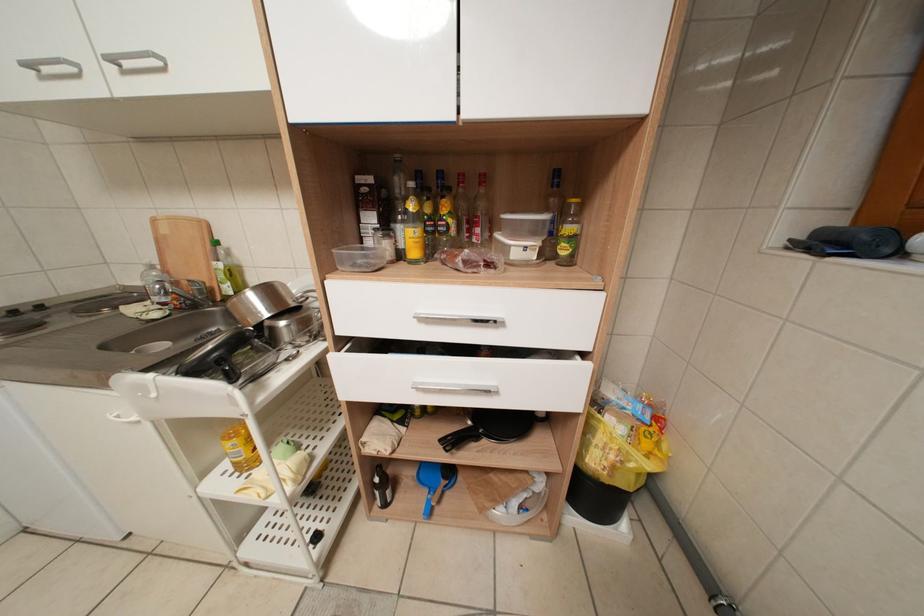
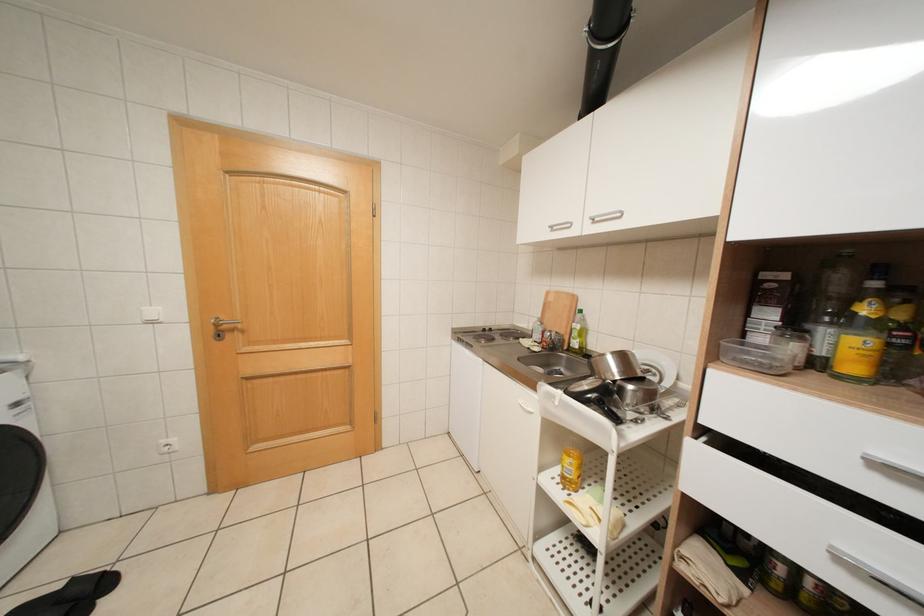
Question: The camera is either moving clockwise (left) or counter-clockwise (right) around the object. The first image is from the beginning of the video and the second image is from the end. Is the camera moving left or right when shooting the video?

Choices:
 (A) Left
 (B) Right

Answer: (B)